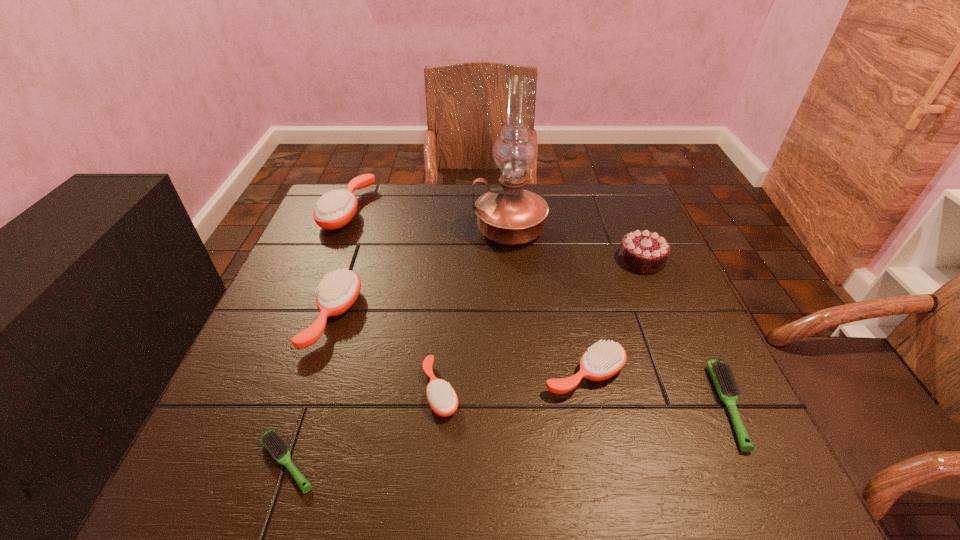
This screenshot has height=540, width=960. What are the coordinates of `unoccupied position between the fifth hairbrush from left to right and the chocolate cake` in the screenshot? It's located at (612, 317).

The height and width of the screenshot is (540, 960). In order to click on empty space between the farthest hairbrush and the right light hairbrush in this screenshot , I will do `click(539, 308)`.

Identify the location of unoccupied area between the farthest hairbrush and the fifth shortest object. (341, 263).

Where is `free space between the farthest hairbrush and the fifth object from right to left`? free space between the farthest hairbrush and the fifth object from right to left is located at coordinates (394, 300).

Find the location of a particular element. This screenshot has width=960, height=540. unoccupied area between the tallest hairbrush and the fifth tallest hairbrush is located at coordinates (539, 308).

In order to click on object that is the seventh closest to the third biggest orange hairbrush in this screenshot , I will do (x=334, y=210).

Identify which object is located as the third nearest to the tallest hairbrush. Please provide its 2D coordinates. Your answer should be formatted as a tuple, i.e. [(x, y)], where the tuple contains the x and y coordinates of a point satisfying the conditions above.

[(442, 398)]

Identify which hairbrush is the fifth nearest to the farthest orange hairbrush. Please provide its 2D coordinates. Your answer should be formatted as a tuple, i.e. [(x, y)], where the tuple contains the x and y coordinates of a point satisfying the conditions above.

[(722, 375)]

Where is `the second closest hairbrush to the fourth object from left to right`? This screenshot has width=960, height=540. the second closest hairbrush to the fourth object from left to right is located at coordinates (338, 291).

Identify the location of the third closest orange hairbrush to the smaller light hairbrush. This screenshot has height=540, width=960. (602, 360).